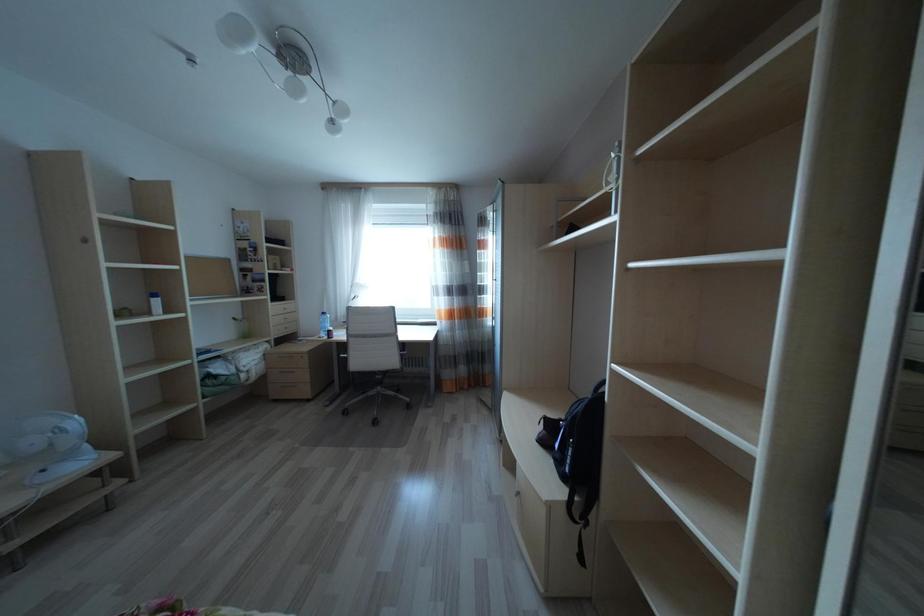
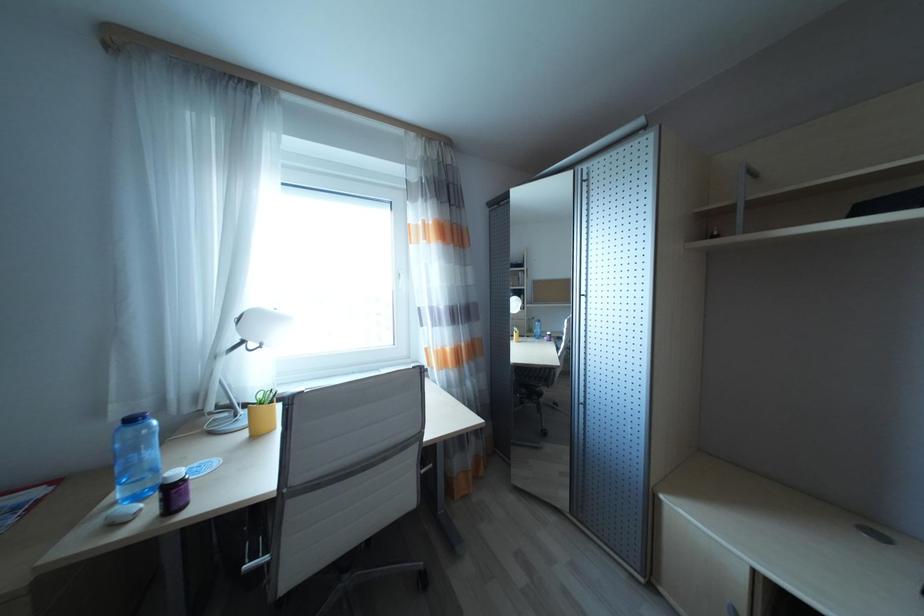
The images are taken continuously from a first-person perspective. In which direction are you moving?

The cameraman walked toward left, forward.